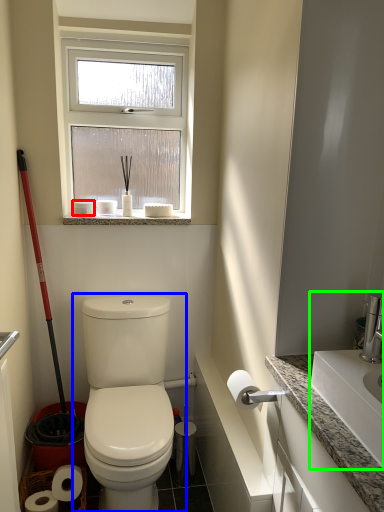
Question: Which object is positioned farthest from toilet paper (highlighted by a red box)? Select from toilet (highlighted by a blue box) and sink (highlighted by a green box).

Choices:
 (A) toilet
 (B) sink

Answer: (B)